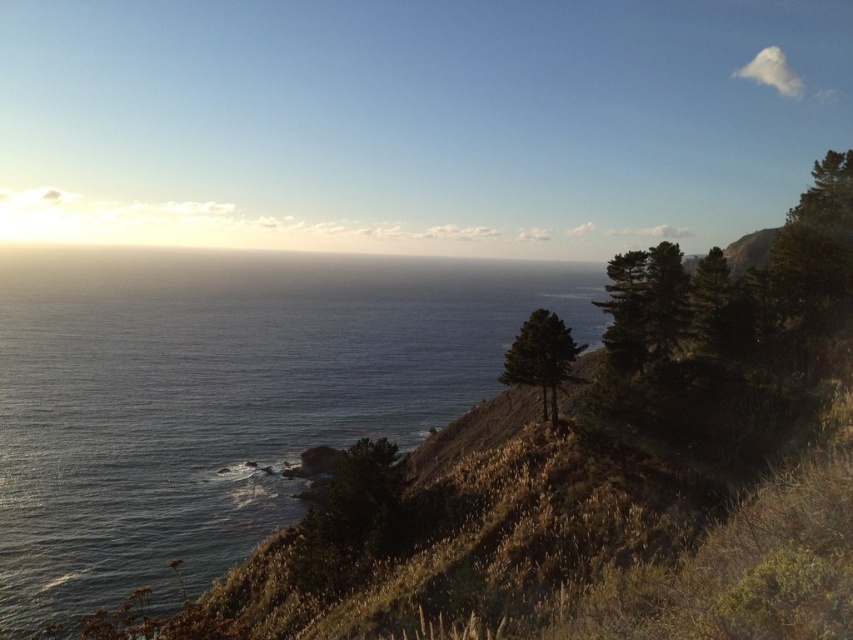
You are standing on a cliff overlooking the ocean. You see the blue water at center and the green leafy tree at upper right. Which object is positioned to the left of the other?

The blue water at center is positioned to the left of the green leafy tree at upper right.

You are standing on the cliff overlooking the blue water at center and the green leafy tree at center. Which object is closer to you, the observer?

The blue water at center is closer to you because the green leafy tree at center is positioned behind it.